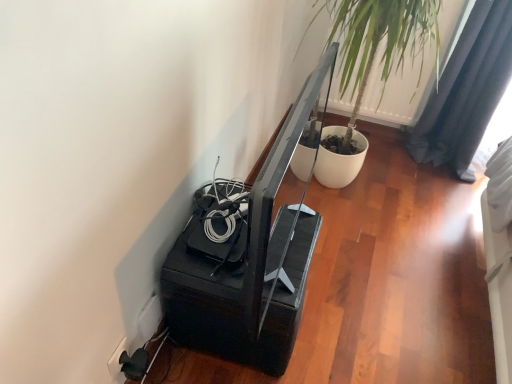
Question: Would you say dark gray fabric curtain at upper right is outside green leafy plant at upper right?

Choices:
 (A) yes
 (B) no

Answer: (A)

Question: Is dark gray fabric curtain at upper right placed right next to green leafy plant at upper right?

Choices:
 (A) yes
 (B) no

Answer: (B)

Question: Is dark gray fabric curtain at upper right at the left side of green leafy plant at upper right?

Choices:
 (A) no
 (B) yes

Answer: (A)

Question: From the image's perspective, is dark gray fabric curtain at upper right below green leafy plant at upper right?

Choices:
 (A) yes
 (B) no

Answer: (A)

Question: Does dark gray fabric curtain at upper right have a smaller size compared to green leafy plant at upper right?

Choices:
 (A) no
 (B) yes

Answer: (A)

Question: Is green leafy plant at upper right inside dark gray fabric curtain at upper right?

Choices:
 (A) yes
 (B) no

Answer: (B)

Question: Is green leafy plant at upper right in front of white plastic electric outlet at lower left, the 2th electric outlet in the left-to-right sequence?

Choices:
 (A) yes
 (B) no

Answer: (B)

Question: From the image's perspective, is green leafy plant at upper right on top of white plastic electric outlet at lower left, the 2th electric outlet in the left-to-right sequence?

Choices:
 (A) no
 (B) yes

Answer: (B)

Question: Does green leafy plant at upper right have a lesser height compared to white plastic electric outlet at lower left, the 1th electric outlet viewed from the right?

Choices:
 (A) no
 (B) yes

Answer: (A)

Question: Does green leafy plant at upper right contain white plastic electric outlet at lower left, the 1th electric outlet viewed from the right?

Choices:
 (A) yes
 (B) no

Answer: (B)

Question: From a real-world perspective, is green leafy plant at upper right located higher than white plastic electric outlet at lower left, the 1th electric outlet viewed from the right?

Choices:
 (A) no
 (B) yes

Answer: (B)

Question: Is green leafy plant at upper right positioned beyond the bounds of white plastic electric outlet at lower left, the 2th electric outlet in the left-to-right sequence?

Choices:
 (A) no
 (B) yes

Answer: (B)

Question: Does white plastic electric outlet at lower left, the first electric outlet when ordered from left to right, come behind green leafy plant at upper right?

Choices:
 (A) yes
 (B) no

Answer: (B)